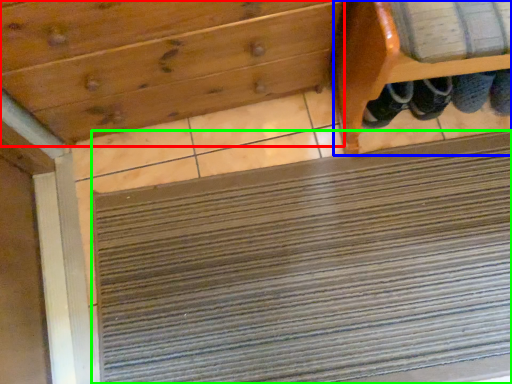
Question: Which is farther away from drawer (highlighted by a red box)? furniture (highlighted by a blue box) or doormat (highlighted by a green box)?

Choices:
 (A) furniture
 (B) doormat

Answer: (B)